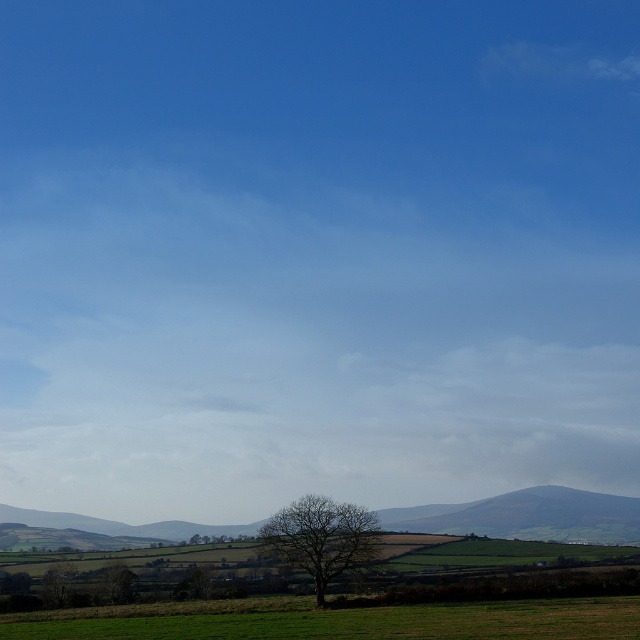
Is point (492, 620) closer to camera compared to point (321, 596)?

That is True.

Who is more forward, (490,609) or (337,516)?

Positioned in front is point (490,609).

You are a GUI agent. You are given a task and a screenshot of the screen. Output one action in this format:
    pyautogui.click(x=<x>, y=<y>)
    Task: Click on the green grassy field at lower center
    
    Given the screenshot: What is the action you would take?
    pyautogui.click(x=364, y=621)

Is green grassy hillside at lower center smaller than green leafy tree at lower center?

Actually, green grassy hillside at lower center might be larger than green leafy tree at lower center.

Does point (528, 488) come closer to viewer compared to point (115, 577)?

No, it is not.

Identify the location of green grassy hillside at lower center. (528, 516).

Consider the image. Can you confirm if green grassy field at lower center is bigger than green leafy tree at lower center?

Correct, green grassy field at lower center is larger in size than green leafy tree at lower center.

Who is lower down, green grassy field at lower center or green leafy tree at lower center?

green leafy tree at lower center is lower down.

Who is more distant from viewer, [433,611] or [116,600]?

The point [116,600] is behind.

Locate an element on the screen. The image size is (640, 640). green grassy field at lower center is located at coordinates (364, 621).